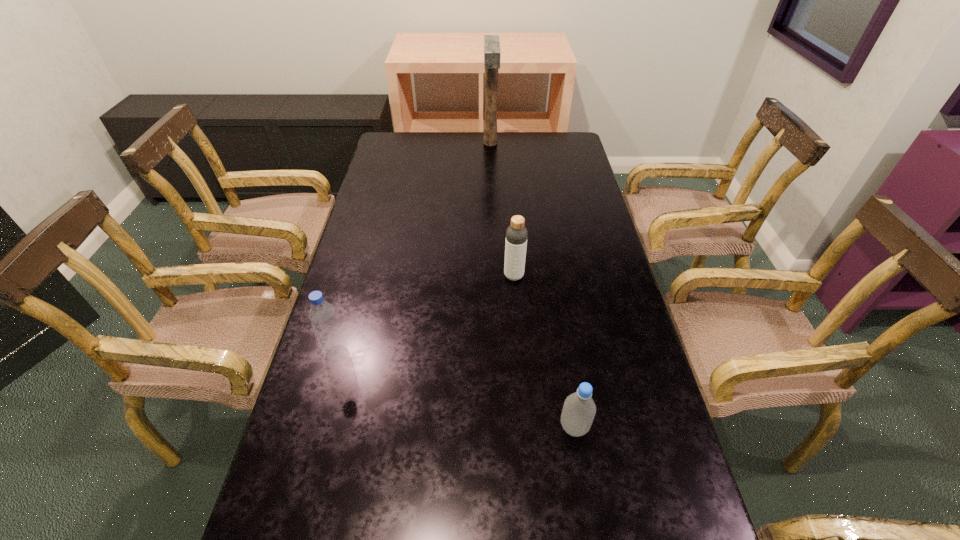
This screenshot has height=540, width=960. I want to click on mallet, so click(x=492, y=54).

Find the location of a particular element. the farthest object is located at coordinates (492, 54).

Find the location of a particular element. This screenshot has width=960, height=540. the third nearest object is located at coordinates (516, 234).

The image size is (960, 540). What are the coordinates of `the farthest bottle` in the screenshot? It's located at (516, 234).

Locate an element on the screen. the leftmost bottle is located at coordinates (322, 315).

Find the location of a particular element. The width and height of the screenshot is (960, 540). the second nearest object is located at coordinates (322, 315).

The image size is (960, 540). Find the location of `the rightmost bottle`. the rightmost bottle is located at coordinates (579, 409).

Image resolution: width=960 pixels, height=540 pixels. What are the coordinates of `the shortest bottle` in the screenshot? It's located at (579, 409).

Identify the location of vacant space located on the left of the farthest object. (465, 143).

Locate an element on the screen. The height and width of the screenshot is (540, 960). blank space located on the back of the second bottle from left to right is located at coordinates (508, 194).